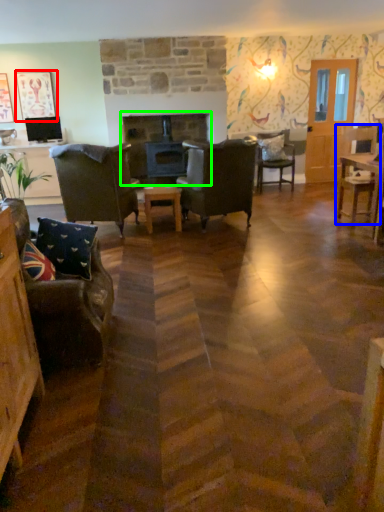
Question: Estimate the real-world distances between objects in this image. Which object is farther from picture frame (highlighted by a red box), chair (highlighted by a blue box) or fireplace (highlighted by a green box)?

Choices:
 (A) chair
 (B) fireplace

Answer: (A)